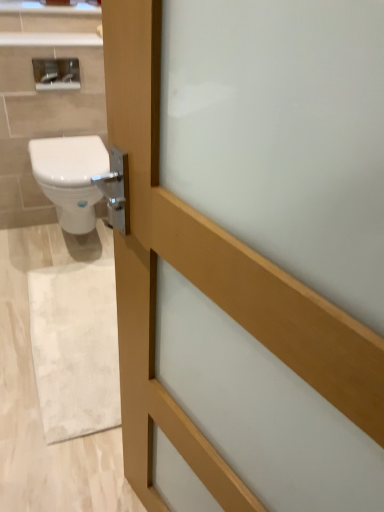
Question: From a real-world perspective, is satin silver mirror at upper left located beneath white marble rug at lower left?

Choices:
 (A) yes
 (B) no

Answer: (B)

Question: Is satin silver mirror at upper left turned away from white marble rug at lower left?

Choices:
 (A) yes
 (B) no

Answer: (B)

Question: Is satin silver mirror at upper left placed right next to white marble rug at lower left?

Choices:
 (A) yes
 (B) no

Answer: (B)

Question: Is satin silver mirror at upper left thinner than white marble rug at lower left?

Choices:
 (A) yes
 (B) no

Answer: (A)

Question: Does satin silver mirror at upper left have a smaller size compared to white marble rug at lower left?

Choices:
 (A) no
 (B) yes

Answer: (B)

Question: Is the position of satin silver mirror at upper left less distant than that of white marble rug at lower left?

Choices:
 (A) yes
 (B) no

Answer: (B)

Question: Is white glossy bidet at left taller than white marble rug at lower left?

Choices:
 (A) yes
 (B) no

Answer: (A)

Question: Is white marble rug at lower left a part of white glossy bidet at left?

Choices:
 (A) yes
 (B) no

Answer: (B)

Question: From a real-world perspective, is white glossy bidet at left beneath white marble rug at lower left?

Choices:
 (A) no
 (B) yes

Answer: (A)

Question: Is white glossy bidet at left beside white marble rug at lower left?

Choices:
 (A) yes
 (B) no

Answer: (B)

Question: Is white glossy bidet at left oriented towards white marble rug at lower left?

Choices:
 (A) no
 (B) yes

Answer: (B)

Question: Is white glossy bidet at left further to the viewer compared to white marble rug at lower left?

Choices:
 (A) no
 (B) yes

Answer: (B)

Question: Can you confirm if white marble rug at lower left is wider than satin silver mirror at upper left?

Choices:
 (A) yes
 (B) no

Answer: (A)